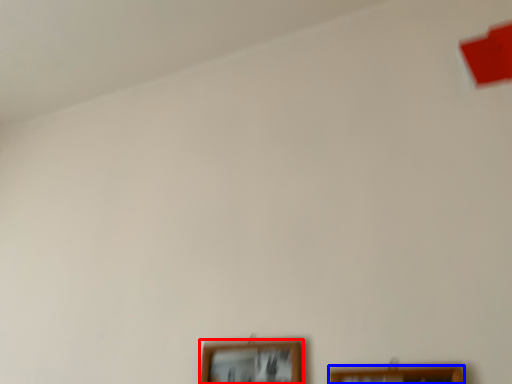
Question: Which object is further to the camera taking this photo, picture frame (highlighted by a red box) or picture frame (highlighted by a blue box)?

Choices:
 (A) picture frame
 (B) picture frame

Answer: (A)